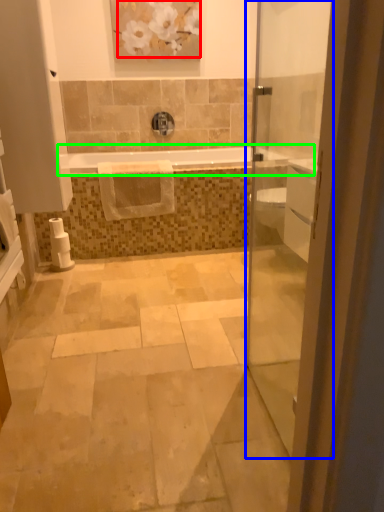
Question: Which is farther away from flower (highlighted by a red box)? door (highlighted by a blue box) or bathtub (highlighted by a green box)?

Choices:
 (A) door
 (B) bathtub

Answer: (B)